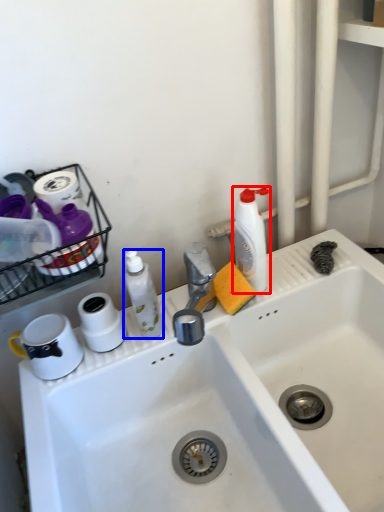
Question: Which of the following is the closest to the observer, cleaning product (highlighted by a red box) or cleaning product (highlighted by a blue box)?

Choices:
 (A) cleaning product
 (B) cleaning product

Answer: (B)